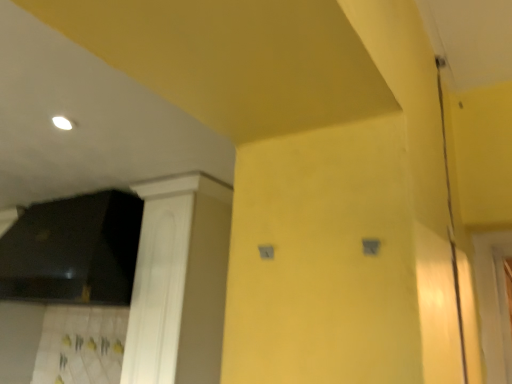
Describe the element at coordinates (179, 282) in the screenshot. I see `white glossy door at left` at that location.

You are a GUI agent. You are given a task and a screenshot of the screen. Output one action in this format:
    pyautogui.click(x=<x>, y=<y>)
    Task: Click on the white glossy door at left
    The image size is (512, 384).
    Given the screenshot: What is the action you would take?
    pyautogui.click(x=179, y=282)

The height and width of the screenshot is (384, 512). Identify the location of white glossy door at left. (179, 282).